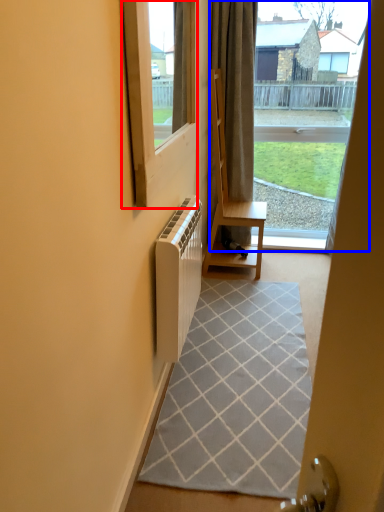
Question: Which point is further to the camera, window (highlighted by a red box) or bay window (highlighted by a blue box)?

Choices:
 (A) window
 (B) bay window

Answer: (B)